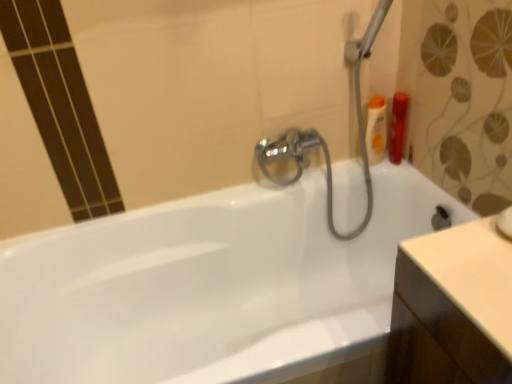
In order to face white glossy bathtub at center, should I rotate leftwards or rightwards?

Turn left approximately 4.174 degrees to face it.

You are a GUI agent. You are given a task and a screenshot of the screen. Output one action in this format:
    pyautogui.click(x=<x>, y=<y>)
    Task: Click on the white glossy bathtub at center
    The height and width of the screenshot is (384, 512).
    Given the screenshot: What is the action you would take?
    pyautogui.click(x=209, y=286)

Is matte orange bottle at upper right, arranged as the first toiletry when viewed from the right, at the back of translucent orange bottle at upper right, which ranks as the second toiletry in right-to-left order?

No, translucent orange bottle at upper right, which ranks as the second toiletry in right-to-left order, is not facing away from matte orange bottle at upper right, arranged as the first toiletry when viewed from the right.

Find the location of a particular element. Image resolution: width=512 pixels, height=384 pixels. toiletry located below the matte orange bottle at upper right, which ranks as the 2th toiletry in left-to-right order (from the image's perspective) is located at coordinates (376, 130).

From the image's perspective, would you say translucent orange bottle at upper right, which ranks as the second toiletry in right-to-left order, is shown under matte orange bottle at upper right, which ranks as the 2th toiletry in left-to-right order?

Yes, from the image's perspective, translucent orange bottle at upper right, which ranks as the second toiletry in right-to-left order, is beneath matte orange bottle at upper right, which ranks as the 2th toiletry in left-to-right order.

Between translucent orange bottle at upper right, which ranks as the second toiletry in right-to-left order, and matte orange bottle at upper right, arranged as the first toiletry when viewed from the right, which one appears on the left side from the viewer's perspective?

From the viewer's perspective, translucent orange bottle at upper right, which ranks as the second toiletry in right-to-left order, appears more on the left side.

At what (x,y) coordinates should I click in order to perform the action: click on toiletry that is the 1st one when counting rightward from the white glossy bathtub at center. Please return your answer as a coordinate pair (x, y). Looking at the image, I should click on (376, 130).

Is translucent orange bottle at upper right, the 1th toiletry in the left-to-right sequence, wider than white glossy bathtub at center?

Incorrect, the width of translucent orange bottle at upper right, the 1th toiletry in the left-to-right sequence, does not surpass that of white glossy bathtub at center.

Can you confirm if translucent orange bottle at upper right, the 1th toiletry in the left-to-right sequence, is positioned to the left of white glossy bathtub at center?

No, translucent orange bottle at upper right, the 1th toiletry in the left-to-right sequence, is not to the left of white glossy bathtub at center.

In the image, is white glossy bathtub at center positioned in front of or behind translucent orange bottle at upper right, the 1th toiletry in the left-to-right sequence?

In the image, white glossy bathtub at center appears in front of translucent orange bottle at upper right, the 1th toiletry in the left-to-right sequence.

Is white glossy bathtub at center situated inside translucent orange bottle at upper right, which ranks as the second toiletry in right-to-left order, or outside?

white glossy bathtub at center lies outside translucent orange bottle at upper right, which ranks as the second toiletry in right-to-left order.

In terms of height, does white glossy bathtub at center look taller or shorter compared to translucent orange bottle at upper right, which ranks as the second toiletry in right-to-left order?

Clearly, white glossy bathtub at center is taller compared to translucent orange bottle at upper right, which ranks as the second toiletry in right-to-left order.

Does white glossy bathtub at center have a lesser width compared to translucent orange bottle at upper right, the 1th toiletry in the left-to-right sequence?

Incorrect, the width of white glossy bathtub at center is not less than that of translucent orange bottle at upper right, the 1th toiletry in the left-to-right sequence.

From the picture: Which object is positioned more to the right, matte orange bottle at upper right, arranged as the first toiletry when viewed from the right, or white glossy bathtub at center?

matte orange bottle at upper right, arranged as the first toiletry when viewed from the right, is more to the right.

Does matte orange bottle at upper right, arranged as the first toiletry when viewed from the right, come behind white glossy bathtub at center?

Yes.

How much distance is there between matte orange bottle at upper right, which ranks as the 2th toiletry in left-to-right order, and white glossy bathtub at center?

A distance of 24.39 inches exists between matte orange bottle at upper right, which ranks as the 2th toiletry in left-to-right order, and white glossy bathtub at center.

From the image's perspective, which object appears higher, matte orange bottle at upper right, arranged as the first toiletry when viewed from the right, or translucent orange bottle at upper right, which ranks as the second toiletry in right-to-left order?

matte orange bottle at upper right, arranged as the first toiletry when viewed from the right, is shown above in the image.

Considering the points (395, 103) and (371, 122), which point is behind, point (395, 103) or point (371, 122)?

The point (371, 122) is more distant.

How much distance is there between matte orange bottle at upper right, arranged as the first toiletry when viewed from the right, and translucent orange bottle at upper right, which ranks as the second toiletry in right-to-left order?

1.97 inches.

Can you confirm if matte orange bottle at upper right, which ranks as the 2th toiletry in left-to-right order, is shorter than translucent orange bottle at upper right, which ranks as the second toiletry in right-to-left order?

Yes.

How far apart are white glossy bathtub at center and matte orange bottle at upper right, arranged as the first toiletry when viewed from the right?

24.39 inches.

Which object is more forward, white glossy bathtub at center or matte orange bottle at upper right, arranged as the first toiletry when viewed from the right?

white glossy bathtub at center is more forward.

Is white glossy bathtub at center completely or partially outside of matte orange bottle at upper right, arranged as the first toiletry when viewed from the right?

Indeed, white glossy bathtub at center is completely outside matte orange bottle at upper right, arranged as the first toiletry when viewed from the right.

Considering the sizes of white glossy bathtub at center and matte orange bottle at upper right, which ranks as the 2th toiletry in left-to-right order, in the image, is white glossy bathtub at center taller or shorter than matte orange bottle at upper right, which ranks as the 2th toiletry in left-to-right order,?

Considering their sizes, white glossy bathtub at center has more height than matte orange bottle at upper right, which ranks as the 2th toiletry in left-to-right order.

The width and height of the screenshot is (512, 384). What are the coordinates of `toiletry on the left of matte orange bottle at upper right, arranged as the first toiletry when viewed from the right` in the screenshot? It's located at (376, 130).

Locate an element on the screen. Image resolution: width=512 pixels, height=384 pixels. toiletry that is the 1st object to the right of the white glossy bathtub at center, starting at the anchor is located at coordinates (376, 130).

Looking at the image, which one is located further to white glossy bathtub at center, translucent orange bottle at upper right, the 1th toiletry in the left-to-right sequence, or matte orange bottle at upper right, which ranks as the 2th toiletry in left-to-right order?

matte orange bottle at upper right, which ranks as the 2th toiletry in left-to-right order, is positioned further to the anchor white glossy bathtub at center.

Looking at the image, which one is located closer to translucent orange bottle at upper right, the 1th toiletry in the left-to-right sequence, white glossy bathtub at center or matte orange bottle at upper right, which ranks as the 2th toiletry in left-to-right order?

matte orange bottle at upper right, which ranks as the 2th toiletry in left-to-right order, lies closer to translucent orange bottle at upper right, the 1th toiletry in the left-to-right sequence, than the other object.

From the image, which object appears to be nearer to translucent orange bottle at upper right, the 1th toiletry in the left-to-right sequence, matte orange bottle at upper right, arranged as the first toiletry when viewed from the right, or white glossy bathtub at center?

matte orange bottle at upper right, arranged as the first toiletry when viewed from the right, is positioned closer to the anchor translucent orange bottle at upper right, the 1th toiletry in the left-to-right sequence.

Which object lies nearer to the anchor point matte orange bottle at upper right, which ranks as the 2th toiletry in left-to-right order, white glossy bathtub at center or translucent orange bottle at upper right, which ranks as the second toiletry in right-to-left order?

translucent orange bottle at upper right, which ranks as the second toiletry in right-to-left order.

When comparing their distances from matte orange bottle at upper right, which ranks as the 2th toiletry in left-to-right order, does translucent orange bottle at upper right, the 1th toiletry in the left-to-right sequence, or white glossy bathtub at center seem further?

Based on the image, white glossy bathtub at center appears to be further to matte orange bottle at upper right, which ranks as the 2th toiletry in left-to-right order.

Considering their positions, is matte orange bottle at upper right, arranged as the first toiletry when viewed from the right, positioned closer to white glossy bathtub at center than translucent orange bottle at upper right, which ranks as the second toiletry in right-to-left order?

Based on the image, translucent orange bottle at upper right, which ranks as the second toiletry in right-to-left order, appears to be nearer to white glossy bathtub at center.

Image resolution: width=512 pixels, height=384 pixels. In order to click on toiletry between white glossy bathtub at center and translucent orange bottle at upper right, the 1th toiletry in the left-to-right sequence, in the front-back direction in this screenshot , I will do `click(398, 127)`.